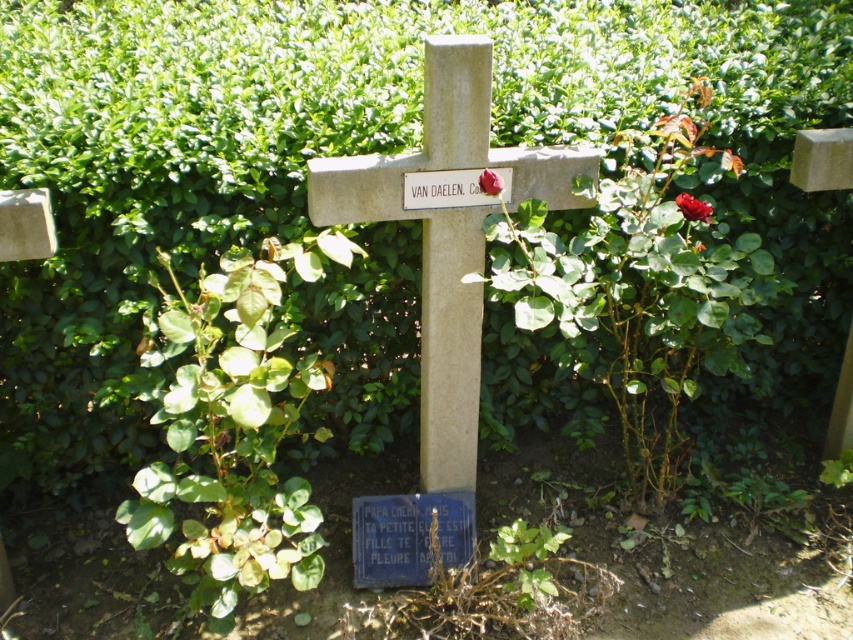
You are a gardener who needs to place a small statue between the glossy red rose at upper right and the red velvet rose at center. The statue requires a minimum of 18 inches of space to be placed safely. Can you fit the statue between them?

The glossy red rose at upper right is 20.17 inches from the red velvet rose at center, which is more than the required 18 inches. Therefore, the statue can be safely placed between them.